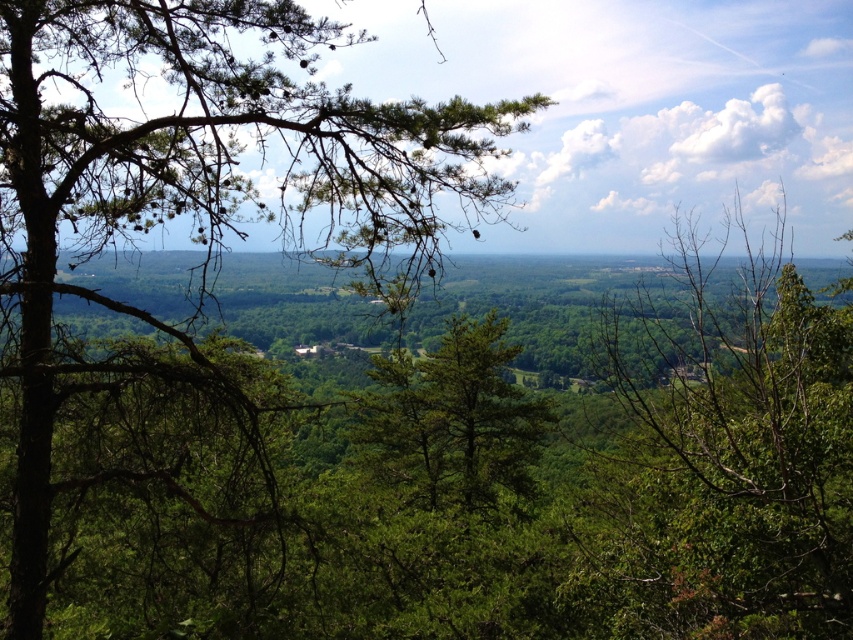
Does green matte tree at upper left have a greater width compared to green leafy tree at center?

Incorrect, green matte tree at upper left's width does not surpass green leafy tree at center's.

Who is shorter, green matte tree at upper left or green leafy tree at center?

With less height is green matte tree at upper left.

Does point (48, 321) come behind point (775, 563)?

Yes, it is behind point (775, 563).

Locate an element on the screen. This screenshot has width=853, height=640. green matte tree at upper left is located at coordinates (195, 177).